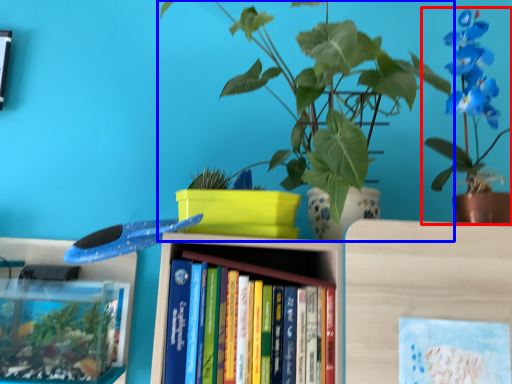
Question: Which object is closer to the camera taking this photo, houseplant (highlighted by a red box) or houseplant (highlighted by a blue box)?

Choices:
 (A) houseplant
 (B) houseplant

Answer: (B)